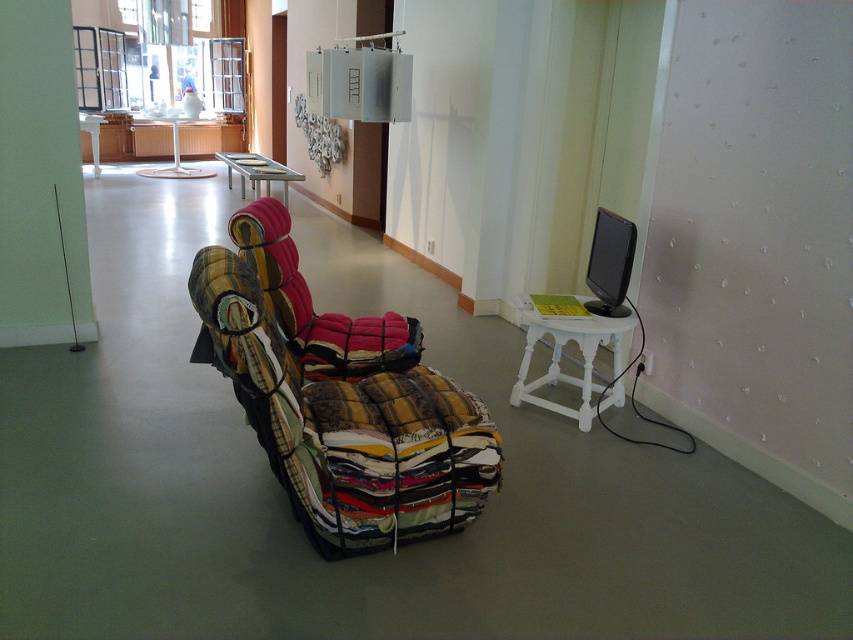
Question: Which point is farther to the camera?

Choices:
 (A) (546, 323)
 (B) (390, 472)
 (C) (248, 250)
 (D) (236, 161)

Answer: (D)

Question: Which point appears farthest from the camera in this image?

Choices:
 (A) (227, 230)
 (B) (233, 154)
 (C) (579, 406)

Answer: (B)

Question: Is multicolored patchwork swivel chair at center above metallic silver table at upper center?

Choices:
 (A) no
 (B) yes

Answer: (A)

Question: Is white wooden stool at right bigger than metallic silver table at upper center?

Choices:
 (A) no
 (B) yes

Answer: (A)

Question: Which object appears farthest from the camera in this image?

Choices:
 (A) patchwork fabric chair at center
 (B) multicolored patchwork swivel chair at center
 (C) metallic silver table at upper center

Answer: (C)

Question: Is patchwork fabric chair at center closer to camera compared to metallic silver table at upper center?

Choices:
 (A) yes
 (B) no

Answer: (A)